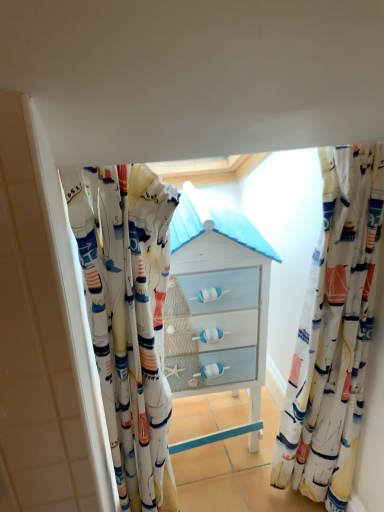
What do you see at coordinates (216, 308) in the screenshot? The height and width of the screenshot is (512, 384). I see `matte white chest of drawers at center` at bounding box center [216, 308].

How much space does sailboat-patterned fabric at right, which appears as the 1th curtain when viewed from the right, occupy horizontally?

sailboat-patterned fabric at right, which appears as the 1th curtain when viewed from the right, is 15.85 centimeters wide.

What do you see at coordinates (127, 319) in the screenshot? This screenshot has height=512, width=384. I see `white fabric curtain at center, marked as the 1th curtain in a left-to-right arrangement` at bounding box center [127, 319].

This screenshot has width=384, height=512. In order to click on matte white chest of drawers at center in this screenshot , I will do `click(216, 308)`.

In the scene shown: Is matte white chest of drawers at center inside the boundaries of white fabric curtain at center, placed as the 2th curtain when sorted from right to left, or outside?

matte white chest of drawers at center cannot be found inside white fabric curtain at center, placed as the 2th curtain when sorted from right to left.

Considering the relative positions of matte white chest of drawers at center and white fabric curtain at center, placed as the 2th curtain when sorted from right to left, in the image provided, is matte white chest of drawers at center to the right of white fabric curtain at center, placed as the 2th curtain when sorted from right to left, from the viewer's perspective?

Yes.

Consider the image. Which object is wider, matte white chest of drawers at center or white fabric curtain at center, placed as the 2th curtain when sorted from right to left?

Wider between the two is matte white chest of drawers at center.

Which of these two, white fabric curtain at center, marked as the 1th curtain in a left-to-right arrangement, or sailboat-patterned fabric at right, which appears as the 1th curtain when viewed from the right, is bigger?

white fabric curtain at center, marked as the 1th curtain in a left-to-right arrangement, is bigger.

Is there a large distance between white fabric curtain at center, placed as the 2th curtain when sorted from right to left, and sailboat-patterned fabric at right, which ranks as the second curtain in left-to-right order?

No, white fabric curtain at center, placed as the 2th curtain when sorted from right to left, is not far from sailboat-patterned fabric at right, which ranks as the second curtain in left-to-right order.

Considering the relative positions of white fabric curtain at center, placed as the 2th curtain when sorted from right to left, and sailboat-patterned fabric at right, which appears as the 1th curtain when viewed from the right, in the image provided, is white fabric curtain at center, placed as the 2th curtain when sorted from right to left, to the right of sailboat-patterned fabric at right, which appears as the 1th curtain when viewed from the right, from the viewer's perspective?

In fact, white fabric curtain at center, placed as the 2th curtain when sorted from right to left, is to the left of sailboat-patterned fabric at right, which appears as the 1th curtain when viewed from the right.

Which of these two, white fabric curtain at center, placed as the 2th curtain when sorted from right to left, or matte white chest of drawers at center, is smaller?

white fabric curtain at center, placed as the 2th curtain when sorted from right to left, is smaller.

Locate an element on the screen. The width and height of the screenshot is (384, 512). chest of drawers lying on the right of white fabric curtain at center, marked as the 1th curtain in a left-to-right arrangement is located at coordinates (216, 308).

What's the angular difference between white fabric curtain at center, marked as the 1th curtain in a left-to-right arrangement, and matte white chest of drawers at center's facing directions?

3.32 degrees separate the facing orientations of white fabric curtain at center, marked as the 1th curtain in a left-to-right arrangement, and matte white chest of drawers at center.

Is white fabric curtain at center, marked as the 1th curtain in a left-to-right arrangement, oriented away from matte white chest of drawers at center?

white fabric curtain at center, marked as the 1th curtain in a left-to-right arrangement, does not have its back to matte white chest of drawers at center.

Is sailboat-patterned fabric at right, which ranks as the second curtain in left-to-right order, oriented towards matte white chest of drawers at center?

No, sailboat-patterned fabric at right, which ranks as the second curtain in left-to-right order, is not turned towards matte white chest of drawers at center.

Does sailboat-patterned fabric at right, which appears as the 1th curtain when viewed from the right, have a smaller size compared to matte white chest of drawers at center?

Yes.

Between sailboat-patterned fabric at right, which ranks as the second curtain in left-to-right order, and matte white chest of drawers at center, which one has larger width?

Wider between the two is matte white chest of drawers at center.

Is sailboat-patterned fabric at right, which ranks as the second curtain in left-to-right order, far from matte white chest of drawers at center?

That's not correct — sailboat-patterned fabric at right, which ranks as the second curtain in left-to-right order, is a little close to matte white chest of drawers at center.

The width and height of the screenshot is (384, 512). Identify the location of curtain on the left of sailboat-patterned fabric at right, which appears as the 1th curtain when viewed from the right. (127, 319).

From the picture: Is sailboat-patterned fabric at right, which ranks as the second curtain in left-to-right order, wider or thinner than white fabric curtain at center, marked as the 1th curtain in a left-to-right arrangement?

Clearly, sailboat-patterned fabric at right, which ranks as the second curtain in left-to-right order, has less width compared to white fabric curtain at center, marked as the 1th curtain in a left-to-right arrangement.

Consider the image. Between sailboat-patterned fabric at right, which appears as the 1th curtain when viewed from the right, and white fabric curtain at center, marked as the 1th curtain in a left-to-right arrangement, which one has more height?

white fabric curtain at center, marked as the 1th curtain in a left-to-right arrangement.

Considering the sizes of sailboat-patterned fabric at right, which ranks as the second curtain in left-to-right order, and white fabric curtain at center, marked as the 1th curtain in a left-to-right arrangement, in the image, is sailboat-patterned fabric at right, which ranks as the second curtain in left-to-right order, bigger or smaller than white fabric curtain at center, marked as the 1th curtain in a left-to-right arrangement,?

sailboat-patterned fabric at right, which ranks as the second curtain in left-to-right order, is smaller than white fabric curtain at center, marked as the 1th curtain in a left-to-right arrangement.

Would you say matte white chest of drawers at center is outside sailboat-patterned fabric at right, which ranks as the second curtain in left-to-right order?

Indeed, matte white chest of drawers at center is completely outside sailboat-patterned fabric at right, which ranks as the second curtain in left-to-right order.

Considering the points (178, 211) and (372, 245), which point is behind, point (178, 211) or point (372, 245)?

The point (178, 211) is farther from the camera.

Looking at this image, from a real-world perspective, between matte white chest of drawers at center and sailboat-patterned fabric at right, which appears as the 1th curtain when viewed from the right, who is vertically higher?

sailboat-patterned fabric at right, which appears as the 1th curtain when viewed from the right, is physically above.

Which object is closer to the camera, matte white chest of drawers at center or sailboat-patterned fabric at right, which appears as the 1th curtain when viewed from the right?

Positioned in front is sailboat-patterned fabric at right, which appears as the 1th curtain when viewed from the right.

I want to click on the chest of drawers that appears above the white fabric curtain at center, marked as the 1th curtain in a left-to-right arrangement (from the image's perspective), so click(x=216, y=308).

This screenshot has height=512, width=384. I want to click on curtain that appears below the sailboat-patterned fabric at right, which appears as the 1th curtain when viewed from the right (from a real-world perspective), so click(x=127, y=319).

When comparing their distances from sailboat-patterned fabric at right, which appears as the 1th curtain when viewed from the right, does matte white chest of drawers at center or white fabric curtain at center, marked as the 1th curtain in a left-to-right arrangement, seem closer?

Based on the image, matte white chest of drawers at center appears to be nearer to sailboat-patterned fabric at right, which appears as the 1th curtain when viewed from the right.

Considering their positions, is sailboat-patterned fabric at right, which appears as the 1th curtain when viewed from the right, positioned further to white fabric curtain at center, placed as the 2th curtain when sorted from right to left, than matte white chest of drawers at center?

Among the two, sailboat-patterned fabric at right, which appears as the 1th curtain when viewed from the right, is located further to white fabric curtain at center, placed as the 2th curtain when sorted from right to left.

From the image, which object appears to be farther from white fabric curtain at center, marked as the 1th curtain in a left-to-right arrangement, matte white chest of drawers at center or sailboat-patterned fabric at right, which ranks as the second curtain in left-to-right order?

sailboat-patterned fabric at right, which ranks as the second curtain in left-to-right order.

When comparing their distances from matte white chest of drawers at center, does sailboat-patterned fabric at right, which appears as the 1th curtain when viewed from the right, or white fabric curtain at center, marked as the 1th curtain in a left-to-right arrangement, seem closer?

white fabric curtain at center, marked as the 1th curtain in a left-to-right arrangement, is closer to matte white chest of drawers at center.

Consider the image. From the image, which object appears to be farther from matte white chest of drawers at center, white fabric curtain at center, marked as the 1th curtain in a left-to-right arrangement, or sailboat-patterned fabric at right, which ranks as the second curtain in left-to-right order?

Based on the image, sailboat-patterned fabric at right, which ranks as the second curtain in left-to-right order, appears to be further to matte white chest of drawers at center.

Based on their spatial positions, is white fabric curtain at center, marked as the 1th curtain in a left-to-right arrangement, or matte white chest of drawers at center further from sailboat-patterned fabric at right, which appears as the 1th curtain when viewed from the right?

Based on the image, white fabric curtain at center, marked as the 1th curtain in a left-to-right arrangement, appears to be further to sailboat-patterned fabric at right, which appears as the 1th curtain when viewed from the right.

The height and width of the screenshot is (512, 384). Identify the location of chest of drawers between white fabric curtain at center, placed as the 2th curtain when sorted from right to left, and sailboat-patterned fabric at right, which ranks as the second curtain in left-to-right order. (216, 308).